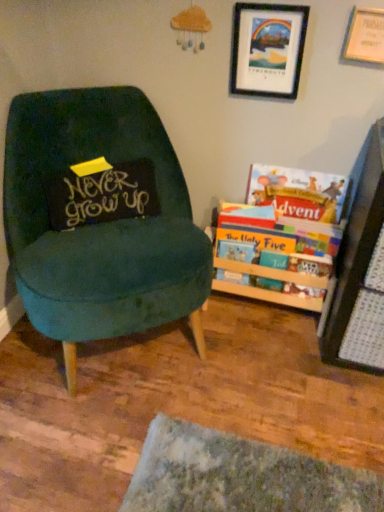
The height and width of the screenshot is (512, 384). In order to click on free space in front of teal velvet chair at left in this screenshot , I will do `click(139, 436)`.